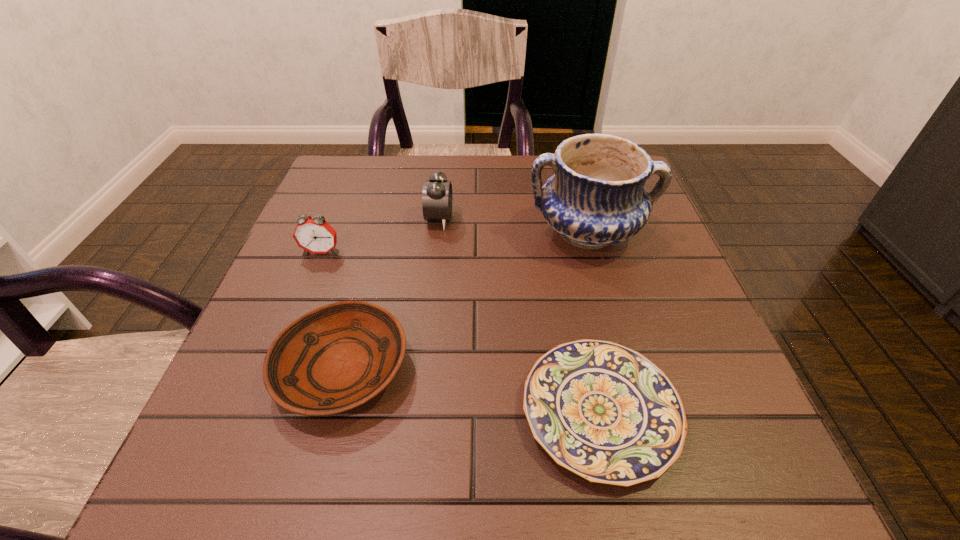
At what (x,y) coordinates should I click in order to perform the action: click on pottery. Please return your answer as a coordinate pair (x, y). Image resolution: width=960 pixels, height=540 pixels. Looking at the image, I should click on (596, 198).

Identify the location of the right alarm clock. This screenshot has width=960, height=540. (437, 191).

Image resolution: width=960 pixels, height=540 pixels. In order to click on the nearer alarm clock in this screenshot , I will do `click(314, 234)`.

I want to click on the taller plate, so click(335, 358).

The height and width of the screenshot is (540, 960). What are the coordinates of `the second shortest object` in the screenshot? It's located at (335, 358).

The image size is (960, 540). Find the location of `the right plate`. the right plate is located at coordinates (605, 412).

You are a GUI agent. You are given a task and a screenshot of the screen. Output one action in this format:
    pyautogui.click(x=<x>, y=<y>)
    Task: Click on the shortest object
    This screenshot has width=960, height=540.
    Given the screenshot: What is the action you would take?
    pyautogui.click(x=605, y=412)

This screenshot has width=960, height=540. Find the location of `free spot located on the left of the pottery`. free spot located on the left of the pottery is located at coordinates (449, 233).

Locate an element on the screen. The image size is (960, 540). vacant space positioned on the front side of the right alarm clock is located at coordinates (536, 219).

I want to click on vacant space located on the clock face of the left alarm clock, so click(x=300, y=308).